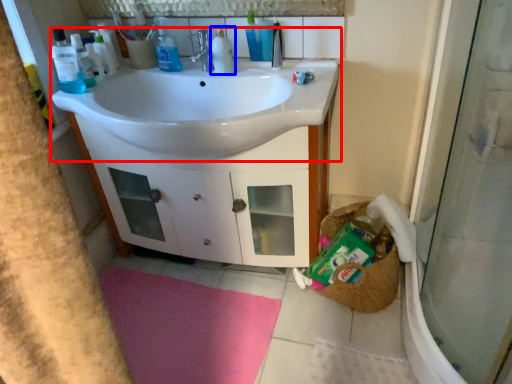
Question: Which point is further to the camera, sink (highlighted by a red box) or cleaning product (highlighted by a blue box)?

Choices:
 (A) sink
 (B) cleaning product

Answer: (B)